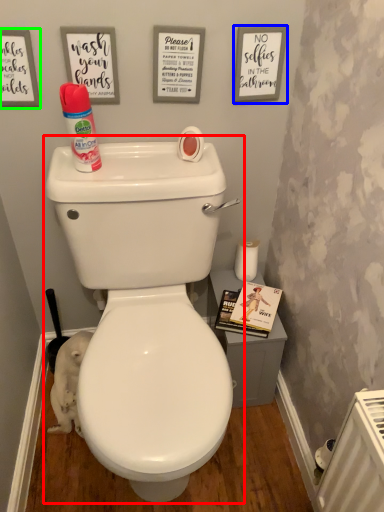
Question: Based on their relative distances, which object is farther from toilet (highlighted by a red box)? Choose from copy (highlighted by a blue box) and copy (highlighted by a green box).

Choices:
 (A) copy
 (B) copy

Answer: (A)